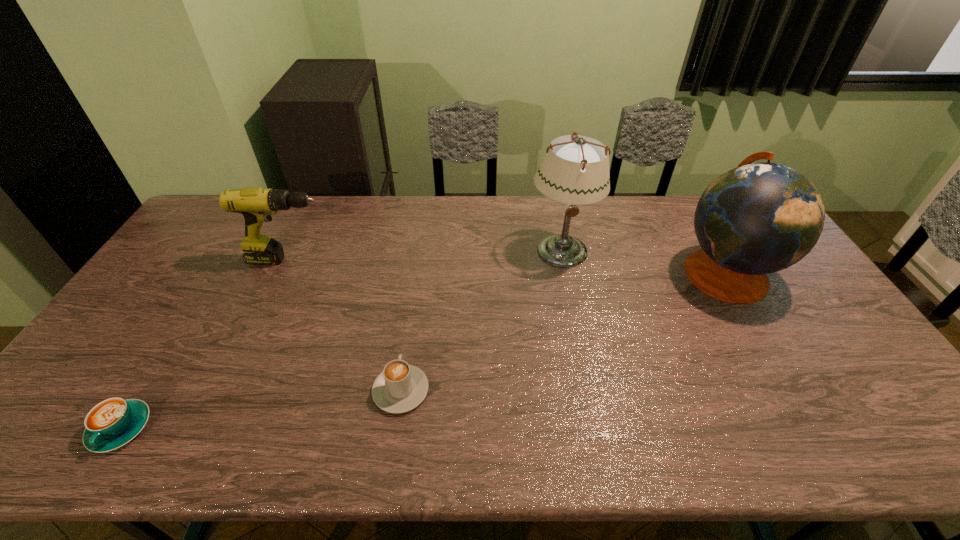
In order to click on object located at the near left corner in this screenshot , I will do `click(112, 423)`.

Locate an element on the screen. vacant region at the far edge of the desktop is located at coordinates (538, 214).

Find the location of a particular element. The image size is (960, 540). free space at the near edge of the desktop is located at coordinates (672, 420).

In the image, there is a desktop. At what (x,y) coordinates should I click in order to perform the action: click on free region at the left edge. Please return your answer as a coordinate pair (x, y). Looking at the image, I should click on coord(144,366).

Locate an element on the screen. This screenshot has height=540, width=960. free space at the right edge of the desktop is located at coordinates (778, 307).

I want to click on vacant space at the near right corner, so click(899, 457).

The image size is (960, 540). In order to click on empty space between the lampshade and the left cappuccino in this screenshot , I will do 341,340.

The image size is (960, 540). In order to click on vacant point located between the taller cappuccino and the left cappuccino in this screenshot , I will do `click(261, 409)`.

Locate an element on the screen. The image size is (960, 540). blank region between the shorter cappuccino and the globe is located at coordinates (422, 350).

You are a GUI agent. You are given a task and a screenshot of the screen. Output one action in this format:
    pyautogui.click(x=<x>, y=<y>)
    Task: Click on the free spot between the fourth object from left to right and the globe
    Image resolution: width=960 pixels, height=540 pixels.
    Given the screenshot: What is the action you would take?
    pyautogui.click(x=642, y=261)